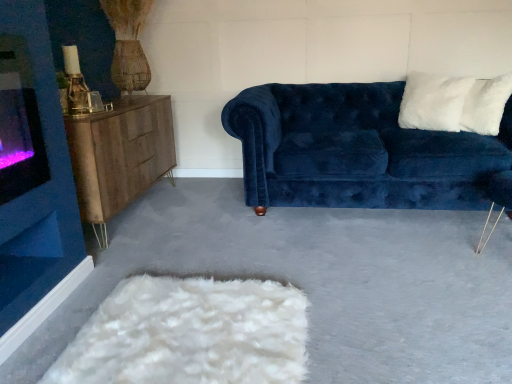
Describe the element at coordinates (486, 105) in the screenshot. The image size is (512, 384). I see `white fluffy pillow at upper right` at that location.

What are the coordinates of `white fluffy pillow at upper right` in the screenshot? It's located at (486, 105).

Considering the sizes of objects velvet blue couch at center and white fluffy pillow at upper right in the image provided, who is wider, velvet blue couch at center or white fluffy pillow at upper right?

With larger width is velvet blue couch at center.

Consider the image. Is velvet blue couch at center taller than white fluffy pillow at upper right?

Yes, velvet blue couch at center is taller than white fluffy pillow at upper right.

From a real-world perspective, is velvet blue couch at center positioned above or below white fluffy pillow at upper right?

velvet blue couch at center is situated lower than white fluffy pillow at upper right in the real world.

Visually, is velvet blue couch at center positioned to the left or to the right of white fluffy pillow at upper right?

velvet blue couch at center is positioned on white fluffy pillow at upper right's left side.

Considering the positions of objects white fluffy pillow at upper right and wooden sideboard at left in the image provided, who is in front, white fluffy pillow at upper right or wooden sideboard at left?

wooden sideboard at left is closer to the camera.

Is white fluffy pillow at upper right taller or shorter than wooden sideboard at left?

In the image, white fluffy pillow at upper right appears to be shorter than wooden sideboard at left.

Which of these two, white fluffy pillow at upper right or wooden sideboard at left, is thinner?

Thinner between the two is white fluffy pillow at upper right.

Does point (463, 128) appear closer or farther from the camera than point (314, 145)?

Point (463, 128) is positioned farther from the camera compared to point (314, 145).

Relative to velvet blue couch at center, is white fluffy pillow at upper right in front or behind?

Clearly, white fluffy pillow at upper right is behind velvet blue couch at center.

Considering the relative sizes of white fluffy pillow at upper right and velvet blue couch at center in the image provided, is white fluffy pillow at upper right taller than velvet blue couch at center?

No.

From a real-world perspective, who is located lower, white fluffy pillow at upper right or velvet blue couch at center?

In real-world perspective, velvet blue couch at center is lower.

From a real-world perspective, is wooden sideboard at left on white fluffy pillow at upper right?

Incorrect, from a real-world perspective, wooden sideboard at left is lower than white fluffy pillow at upper right.

How distant is wooden sideboard at left from white fluffy pillow at upper right?

wooden sideboard at left is 6.47 feet from white fluffy pillow at upper right.

From the image's perspective, is wooden sideboard at left over white fluffy pillow at upper right?

Incorrect, from the image's perspective, wooden sideboard at left is lower than white fluffy pillow at upper right.

From their relative heights in the image, would you say wooden sideboard at left is taller or shorter than velvet blue couch at center?

Considering their sizes, wooden sideboard at left has less height than velvet blue couch at center.

Considering the positions of objects wooden sideboard at left and velvet blue couch at center in the image provided, who is behind, wooden sideboard at left or velvet blue couch at center?

velvet blue couch at center is more distant.

From the image's perspective, is wooden sideboard at left located above velvet blue couch at center?

No, from the image's perspective, wooden sideboard at left is not above velvet blue couch at center.

Is velvet blue couch at center directly adjacent to wooden sideboard at left?

velvet blue couch at center and wooden sideboard at left are clearly separated.

Is velvet blue couch at center oriented away from wooden sideboard at left?

velvet blue couch at center does not have its back to wooden sideboard at left.

Is the depth of velvet blue couch at center greater than that of wooden sideboard at left?

Yes, the depth of velvet blue couch at center is greater than that of wooden sideboard at left.

The image size is (512, 384). I want to click on pillow to the right of velvet blue couch at center, so click(486, 105).

Identify the location of table on the left side of white fluffy pillow at upper right. (119, 156).

Based on their spatial positions, is white fluffy pillow at upper right or velvet blue couch at center further from wooden sideboard at left?

white fluffy pillow at upper right.

Which object lies nearer to the anchor point wooden sideboard at left, velvet blue couch at center or white fluffy pillow at upper right?

The object closer to wooden sideboard at left is velvet blue couch at center.

In the scene shown: When comparing their distances from white fluffy pillow at upper right, does velvet blue couch at center or wooden sideboard at left seem further?

Based on the image, wooden sideboard at left appears to be further to white fluffy pillow at upper right.

Considering their positions, is wooden sideboard at left positioned closer to velvet blue couch at center than white fluffy pillow at upper right?

Based on the image, white fluffy pillow at upper right appears to be nearer to velvet blue couch at center.

Based on their spatial positions, is wooden sideboard at left or velvet blue couch at center further from white fluffy pillow at upper right?

wooden sideboard at left.

Estimate the real-world distances between objects in this image. Which object is further from velvet blue couch at center, white fluffy pillow at upper right or wooden sideboard at left?

wooden sideboard at left is positioned further to the anchor velvet blue couch at center.

The image size is (512, 384). I want to click on studio couch situated between wooden sideboard at left and white fluffy pillow at upper right from left to right, so click(x=361, y=151).